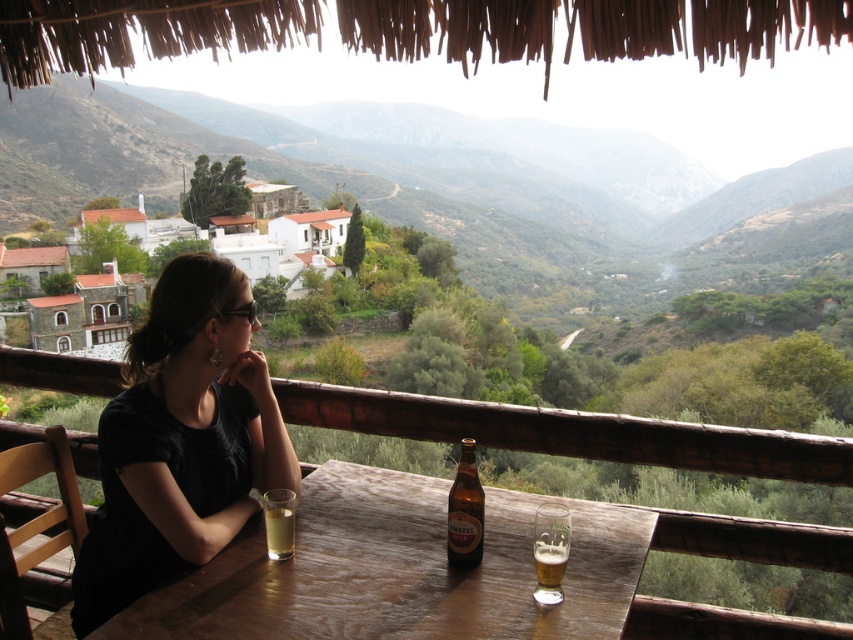
Does brown glass bottle at table lie in front of translucent glass beer at table center?

No, brown glass bottle at table is behind translucent glass beer at table center.

From the picture: Does brown glass bottle at table appear on the left side of translucent glass beer at table center?

Yes, brown glass bottle at table is to the left of translucent glass beer at table center.

Between point (471, 529) and point (538, 541), which one is positioned in front?

Point (538, 541)

You are a GUI agent. You are given a task and a screenshot of the screen. Output one action in this format:
    pyautogui.click(x=<x>, y=<y>)
    Task: Click on the brown glass bottle at table
    Image resolution: width=853 pixels, height=640 pixels.
    Given the screenshot: What is the action you would take?
    pyautogui.click(x=465, y=512)

Which is above, translucent glass at table left or translucent glass beer at table center?

Positioned higher is translucent glass at table left.

Between translucent glass at table left and translucent glass beer at table center, which one is positioned lower?

translucent glass beer at table center is below.

Does point (287, 554) lie behind point (561, 545)?

Yes, point (287, 554) is farther from viewer.

Where is `translucent glass at table left`? translucent glass at table left is located at coordinates (279, 529).

Which is in front, point (378, 566) or point (537, 573)?

Point (537, 573)

Who is higher up, wooden table at center or translucent glass beer at table center?

Positioned higher is wooden table at center.

Is point (228, 554) farther from camera compared to point (555, 563)?

Yes, it is behind point (555, 563).

Where is `wooden table at center`? wooden table at center is located at coordinates (399, 570).